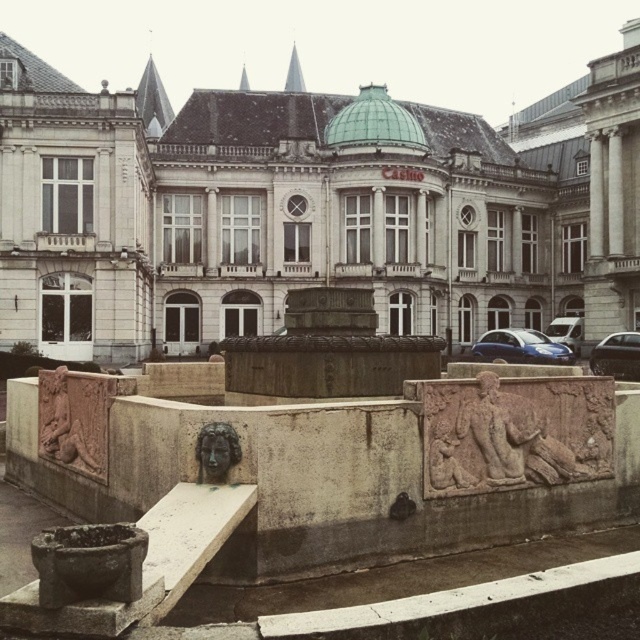
You are an architect designing a new plaza in front of the grand classical building. The plaza will have a central pathway leading directly to the building. Where should the pathway be placed to align with the carved stone relief at center?

The pathway should be placed at point (515, 433) to align with the carved stone relief at center.

You are a photographer positioned at the entrance of the classical building. You want to take a photo that includes both the metallic blue car at center and the bronze textured face at center. Given that your camera has a maximum focal length that allows capturing objects up to 50 meters apart, will you be able to include both subjects in the same frame?

The metallic blue car at center is 55.31 meters from the bronze textured face at center, which exceeds the camera maximum focal length of 50 meters. Therefore, you cannot include both subjects in the same frame.

You are standing in front of the classical building and want to take a photo that includes both the point at coordinates point [564,344] and point [220,480]. Which point is closer to you so that you can focus on it first?

Point [564,344] is closer to you than point [220,480], so you can focus on it first.